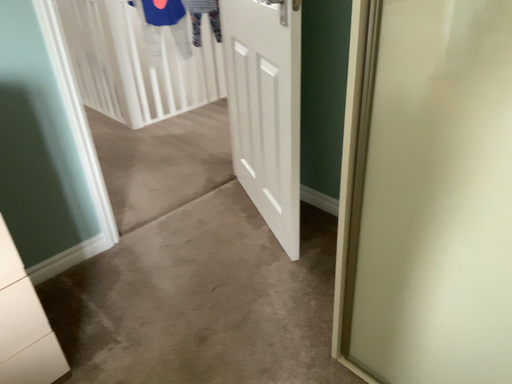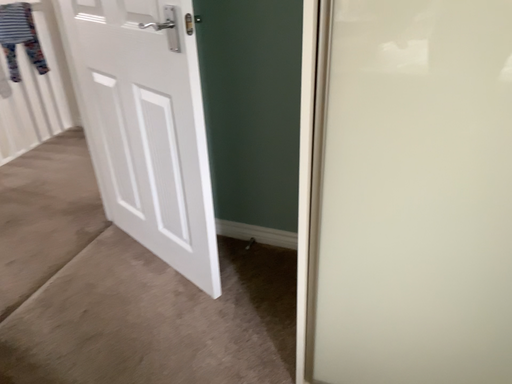
Question: How did the camera likely rotate when shooting the video?

Choices:
 (A) rotated right
 (B) rotated left

Answer: (A)